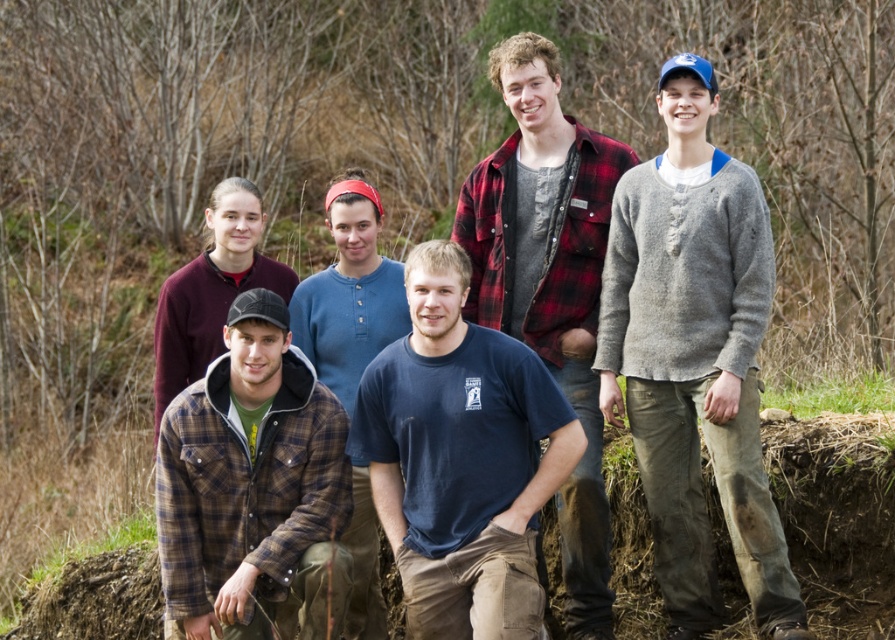
Question: Which object is farther from the camera taking this photo?

Choices:
 (A) plaid flannel shirt at lower left
 (B) gray wool sweater at center
 (C) plaid flannel shirt at center

Answer: (C)

Question: Which point is closer to the camera?

Choices:
 (A) (543, 371)
 (B) (539, 200)

Answer: (A)

Question: Considering the relative positions of dark blue t-shirt at center and plaid flannel shirt at lower left in the image provided, where is dark blue t-shirt at center located with respect to plaid flannel shirt at lower left?

Choices:
 (A) below
 (B) above

Answer: (B)

Question: Can you confirm if plaid flannel shirt at lower left is smaller than plaid flannel shirt at center?

Choices:
 (A) no
 (B) yes

Answer: (B)

Question: Which point appears farthest from the camera in this image?

Choices:
 (A) click(292, 368)
 (B) click(610, 360)

Answer: (B)

Question: Is plaid flannel shirt at lower left bigger than plaid flannel shirt at center?

Choices:
 (A) no
 (B) yes

Answer: (A)